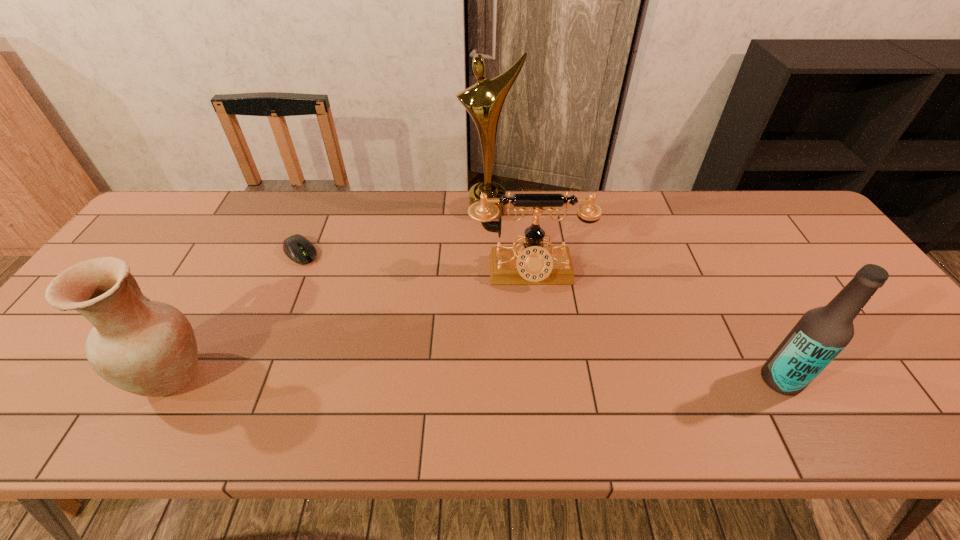
This screenshot has width=960, height=540. I want to click on free space on the desktop that is between the pottery and the beer bottle and is positioned on the wheel side of the shortest object, so click(x=414, y=377).

Find the location of a particular element. This screenshot has height=540, width=960. vacant space on the desktop that is between the leftmost object and the beer bottle and is positioned on the front-facing side of the tallest object is located at coordinates (486, 377).

Image resolution: width=960 pixels, height=540 pixels. Identify the location of free space on the desktop that is between the leftmost object and the beer bottle and is positioned on the dial of the second shortest object. (540, 378).